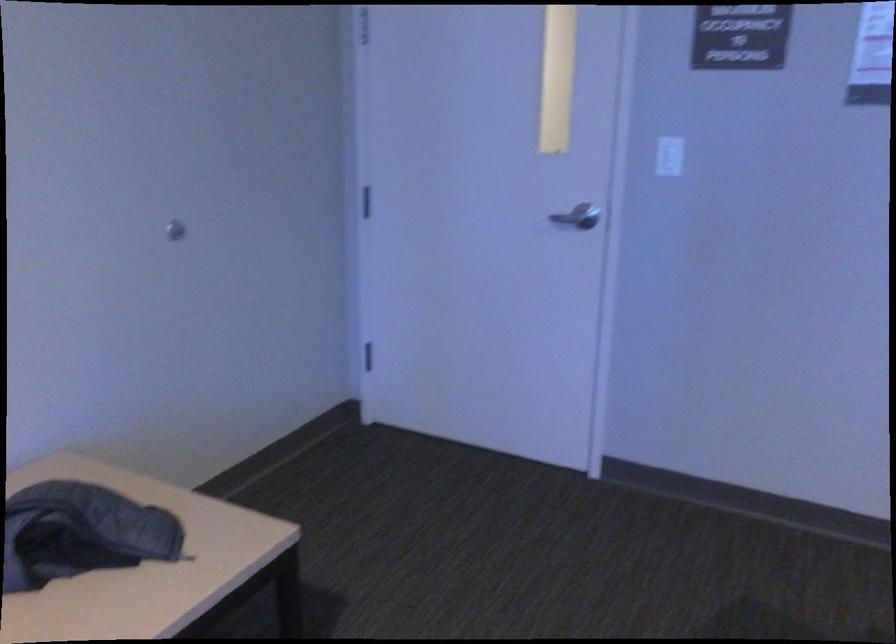
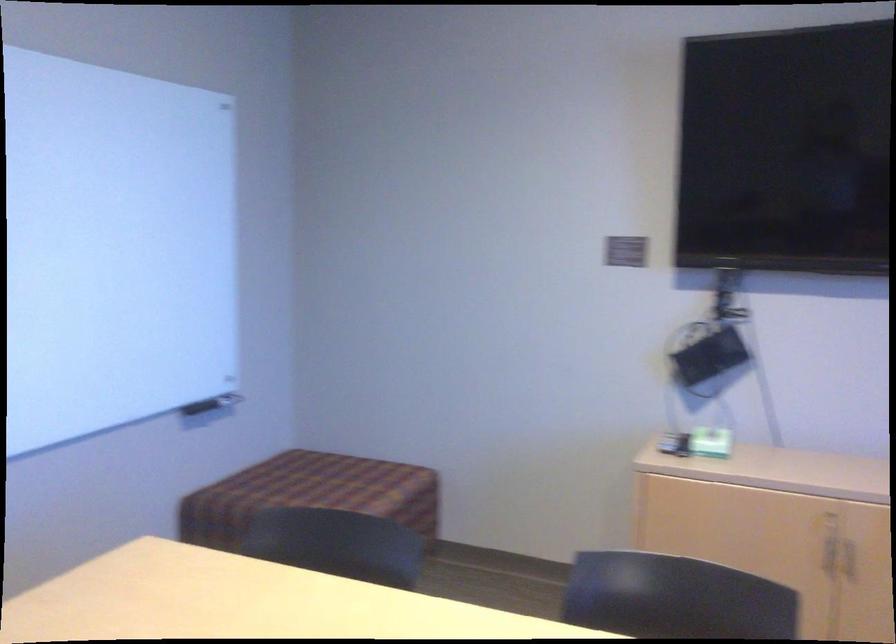
Question: Based on the continuous images, in which direction is the camera rotating? Reply with the corresponding letter.

Choices:
 (A) Left
 (B) Right
 (C) Up
 (D) Down

Answer: (B)